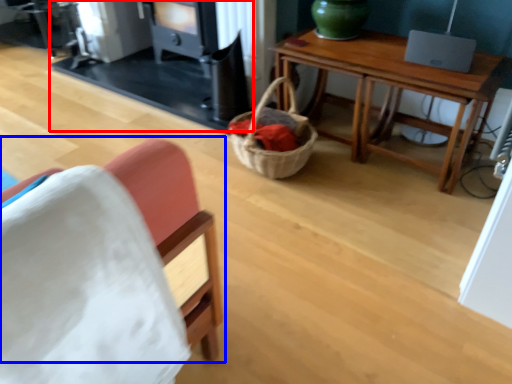
Question: Which of the following is the closest to the observer, fireplace (highlighted by a red box) or chair (highlighted by a blue box)?

Choices:
 (A) fireplace
 (B) chair

Answer: (B)